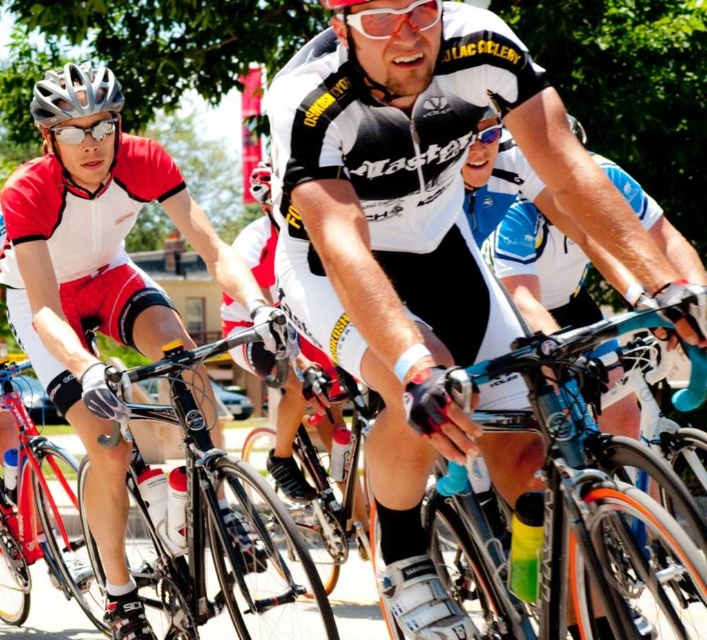
Question: Can you confirm if shiny red bicycle at center is positioned to the left of silver metallic helmet at upper left?

Choices:
 (A) yes
 (B) no

Answer: (A)

Question: Does shiny red bicycle at center appear under matte black helmet at center?

Choices:
 (A) no
 (B) yes

Answer: (B)

Question: Which of the following is the farthest from the observer?

Choices:
 (A) (52, 145)
 (B) (71, 96)
 (C) (402, 20)

Answer: (A)

Question: Estimate the real-world distances between objects in this image. Which object is farther from the silver metallic helmet at left?

Choices:
 (A) white matte jersey at center
 (B) red translucent goggles at center

Answer: (A)

Question: Does black matte bicycle at center appear on the right side of shiny red bicycle at center?

Choices:
 (A) yes
 (B) no

Answer: (A)

Question: Which of the following is the farthest from the observer?

Choices:
 (A) (350, 225)
 (B) (423, 20)
 (C) (4, 381)

Answer: (C)